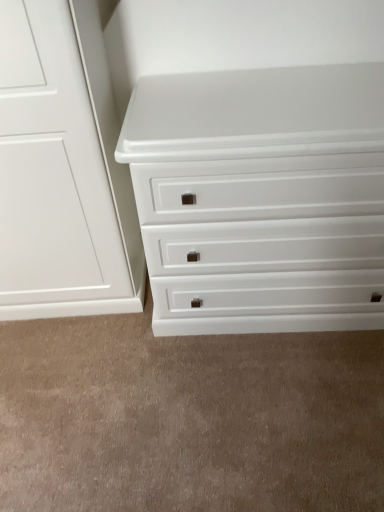
Question: Is white glossy chest of drawers at center at the left side of white matte drawer at lower center?

Choices:
 (A) no
 (B) yes

Answer: (A)

Question: Are white glossy chest of drawers at center and white matte drawer at lower center beside each other?

Choices:
 (A) no
 (B) yes

Answer: (A)

Question: From the image's perspective, does white glossy chest of drawers at center appear higher than white matte drawer at lower center?

Choices:
 (A) no
 (B) yes

Answer: (B)

Question: Does white glossy chest of drawers at center have a smaller size compared to white matte drawer at lower center?

Choices:
 (A) no
 (B) yes

Answer: (A)

Question: Considering the relative sizes of white glossy chest of drawers at center and white matte drawer at lower center in the image provided, is white glossy chest of drawers at center taller than white matte drawer at lower center?

Choices:
 (A) no
 (B) yes

Answer: (B)

Question: Could you tell me if white glossy chest of drawers at center is turned towards white matte drawer at lower center?

Choices:
 (A) yes
 (B) no

Answer: (A)

Question: Could you tell me if white matte drawer at lower center is facing white glossy chest of drawers at center?

Choices:
 (A) yes
 (B) no

Answer: (A)

Question: From the image's perspective, is white matte drawer at lower center above white glossy chest of drawers at center?

Choices:
 (A) no
 (B) yes

Answer: (A)

Question: From the image's perspective, is white matte drawer at lower center beneath white glossy chest of drawers at center?

Choices:
 (A) no
 (B) yes

Answer: (B)

Question: Does white matte drawer at lower center appear on the left side of white glossy chest of drawers at center?

Choices:
 (A) yes
 (B) no

Answer: (A)

Question: Is white glossy chest of drawers at center at the back of white matte drawer at lower center?

Choices:
 (A) no
 (B) yes

Answer: (A)

Question: Would you say white matte drawer at lower center is a long distance from white glossy chest of drawers at center?

Choices:
 (A) no
 (B) yes

Answer: (A)

Question: Choose the correct answer: Is white glossy chest of drawers at center inside white matte drawer at lower center or outside it?

Choices:
 (A) inside
 (B) outside

Answer: (B)